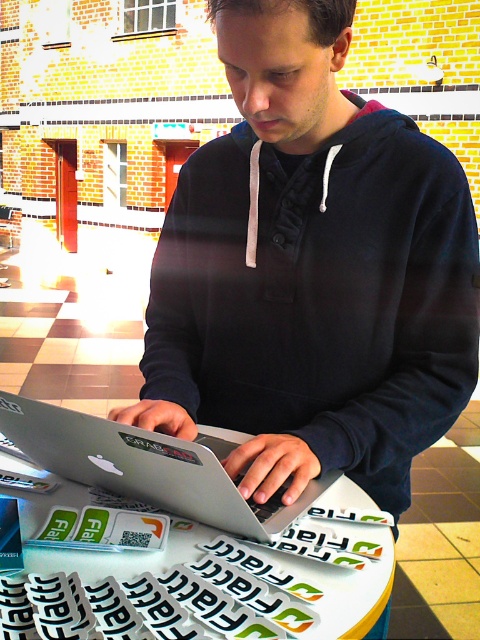
Who is lower down, black cotton sweatshirt at center or white glossy table at center?

white glossy table at center

Is black cotton sweatshirt at center positioned before white glossy table at center?

No.

Does point (268, 266) come closer to viewer compared to point (83, 624)?

No.

I want to click on black cotton sweatshirt at center, so click(x=321, y=296).

Identify the location of black cotton sweatshirt at center. Image resolution: width=480 pixels, height=640 pixels. (321, 296).

Is black cotton sweatshirt at center shorter than silver metallic laptop at center?

No.

Who is more forward, [328,371] or [34,451]?

Point [34,451] is more forward.

Image resolution: width=480 pixels, height=640 pixels. What are the coordinates of `black cotton sweatshirt at center` in the screenshot? It's located at (321, 296).

From the picture: Is white glossy table at center thinner than silver metallic laptop at center?

No, white glossy table at center is not thinner than silver metallic laptop at center.

Is point (70, 589) positioned after point (54, 420)?

That is False.

In order to click on white glossy table at center in this screenshot , I will do `click(188, 568)`.